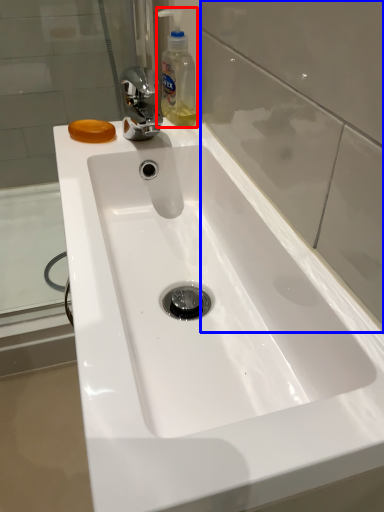
Question: Among these objects, which one is nearest to the camera, cleaning product (highlighted by a red box) or glass door (highlighted by a blue box)?

Choices:
 (A) cleaning product
 (B) glass door

Answer: (B)